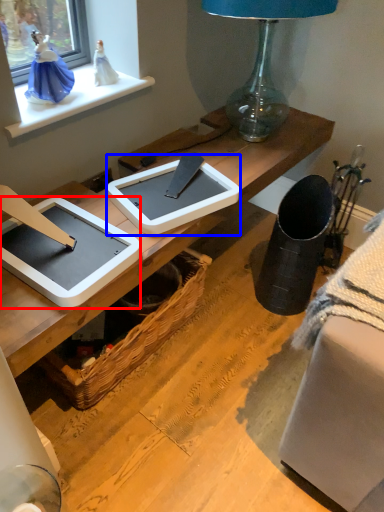
Question: Which object is closer to the camera taking this photo, tablet computer (highlighted by a red box) or tablet computer (highlighted by a blue box)?

Choices:
 (A) tablet computer
 (B) tablet computer

Answer: (A)